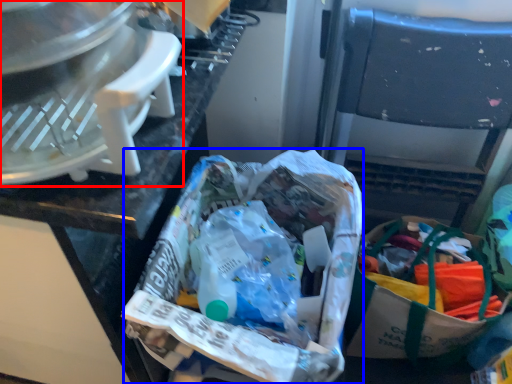
Question: Which point is further to the camera, kitchen appliance (highlighted by a red box) or material (highlighted by a blue box)?

Choices:
 (A) kitchen appliance
 (B) material

Answer: (B)